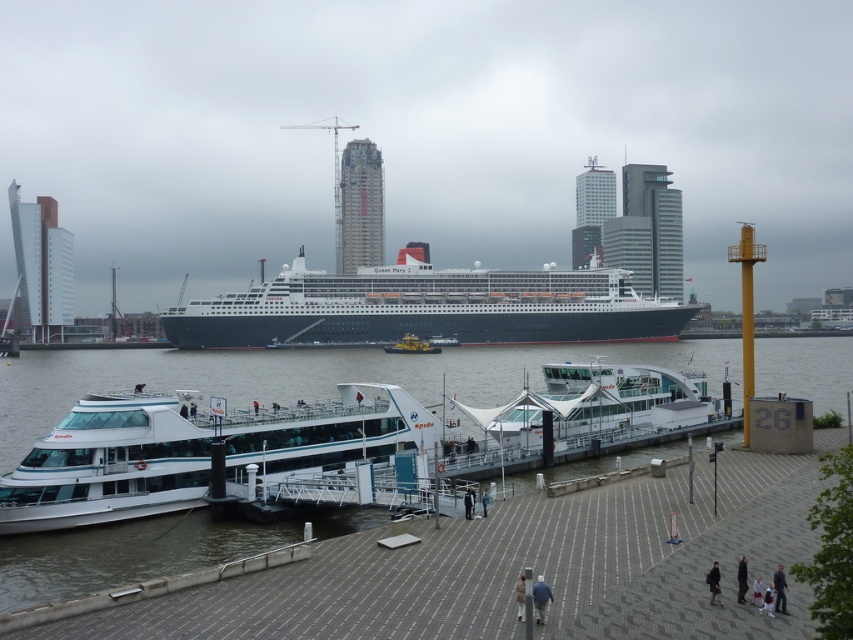
You are a tourist standing on the waterfront walkway and see the white glossy ferry at center and the light blue fabric jacket at lower center. Which object appears bigger in the scene?

The white glossy ferry at center appears bigger than the light blue fabric jacket at lower center because it has a larger size compared to it.

You are a photographer standing on the waterfront walkway and notice two people wearing a dark gray fabric jacket at lower right and light brown fabric pants at lower right. Which clothing item is positioned higher on their body?

The dark gray fabric jacket at lower right is located above the light brown fabric pants at lower right, so the jacket is positioned higher on their body.